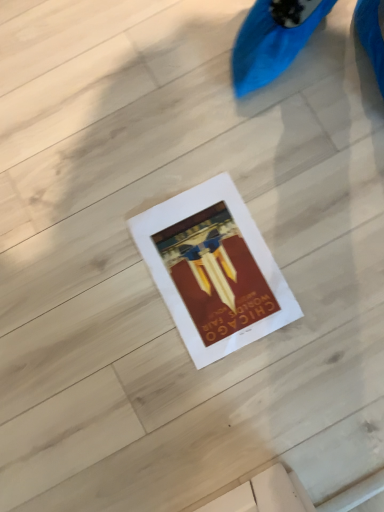
The width and height of the screenshot is (384, 512). What do you see at coordinates (213, 270) in the screenshot?
I see `matte paper poster at center` at bounding box center [213, 270].

Where is `matte paper poster at center`? matte paper poster at center is located at coordinates (213, 270).

This screenshot has width=384, height=512. I want to click on matte paper poster at center, so click(213, 270).